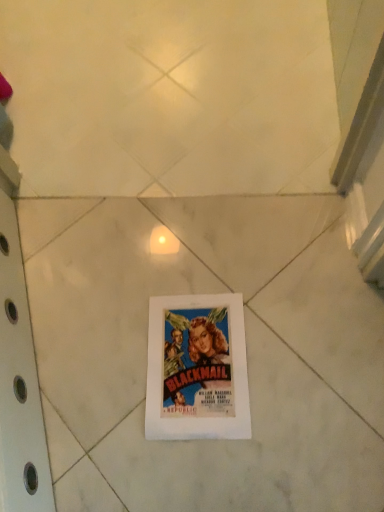
Image resolution: width=384 pixels, height=512 pixels. I want to click on blank space situated above white paper at center (from a real-world perspective), so click(x=204, y=361).